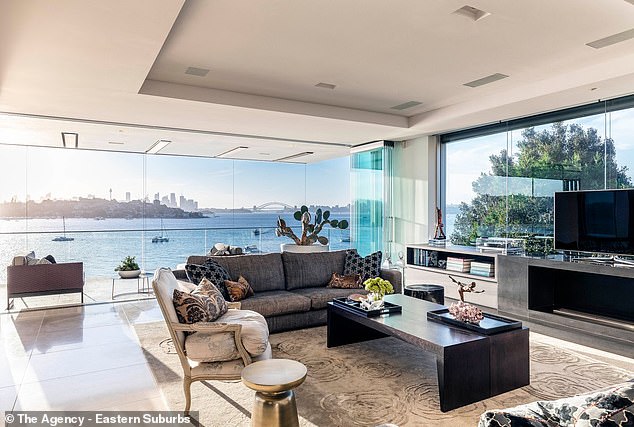
I want to click on cocktail table dark brown, so click(x=467, y=372).